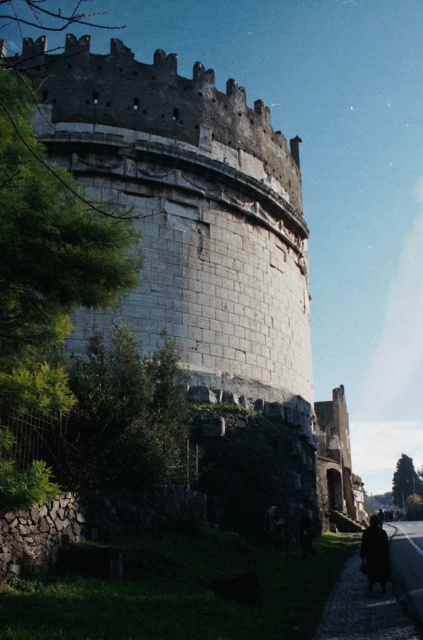
Question: Is white stone fort at center to the right of dark wool coat at lower right from the viewer's perspective?

Choices:
 (A) yes
 (B) no

Answer: (B)

Question: Which of the following is the closest to the observer?

Choices:
 (A) white stone fort at center
 (B) dark wool coat at lower right

Answer: (B)

Question: Can you confirm if white stone fort at center is positioned above dark wool coat at lower right?

Choices:
 (A) yes
 (B) no

Answer: (A)

Question: Among these objects, which one is farthest from the camera?

Choices:
 (A) dark wool coat at lower right
 (B) white stone fort at center

Answer: (B)

Question: Considering the relative positions of white stone fort at center and dark wool coat at lower right in the image provided, where is white stone fort at center located with respect to dark wool coat at lower right?

Choices:
 (A) below
 (B) above

Answer: (B)

Question: Which of the following is the farthest from the observer?

Choices:
 (A) white stone fort at center
 (B) dark wool coat at lower right

Answer: (A)